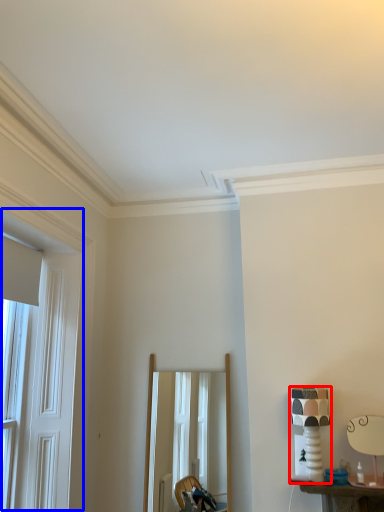
Question: Which object appears farthest to the camera in this image, table lamp (highlighted by a red box) or window (highlighted by a blue box)?

Choices:
 (A) table lamp
 (B) window

Answer: (A)